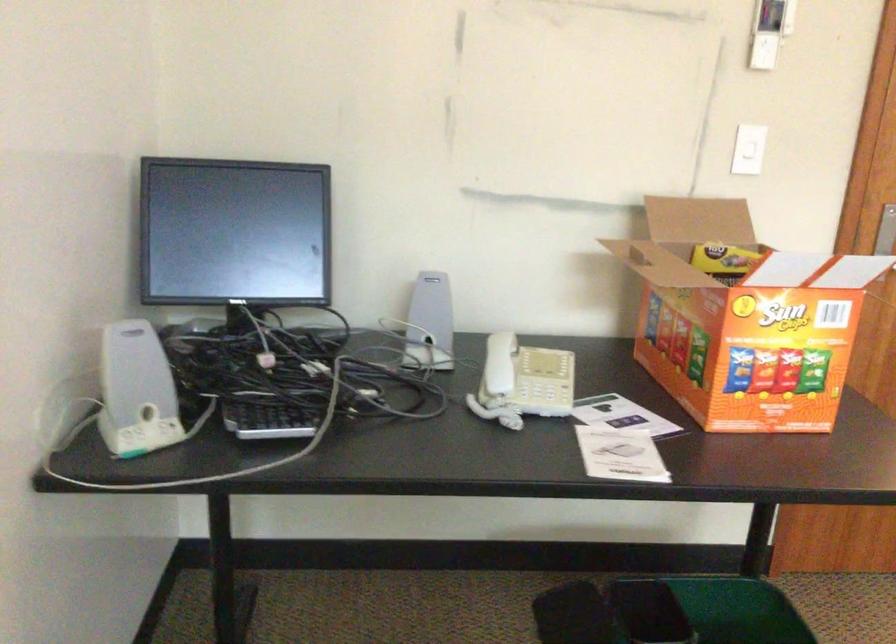
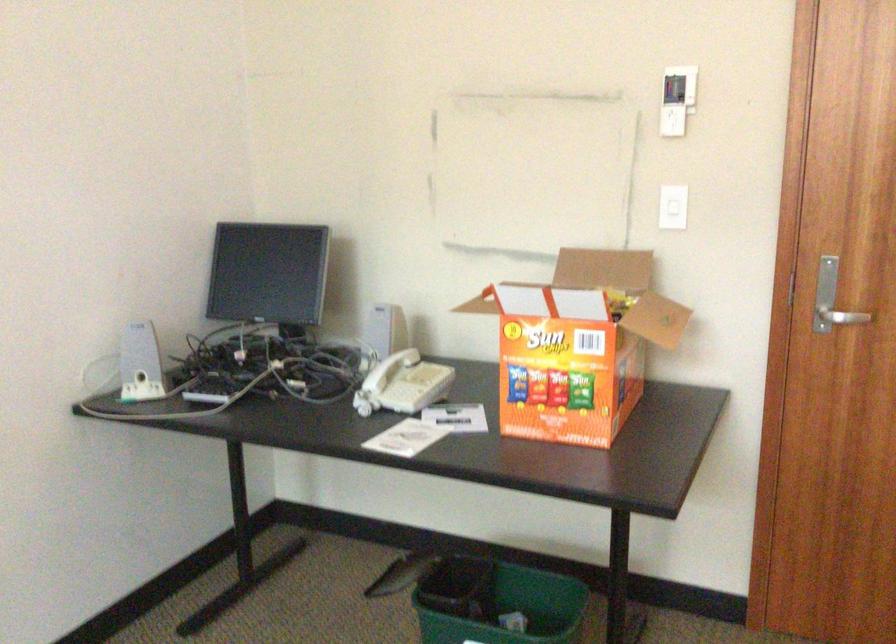
Locate, in the second image, the point that corresponds to point (737, 156) in the first image.

(672, 214)